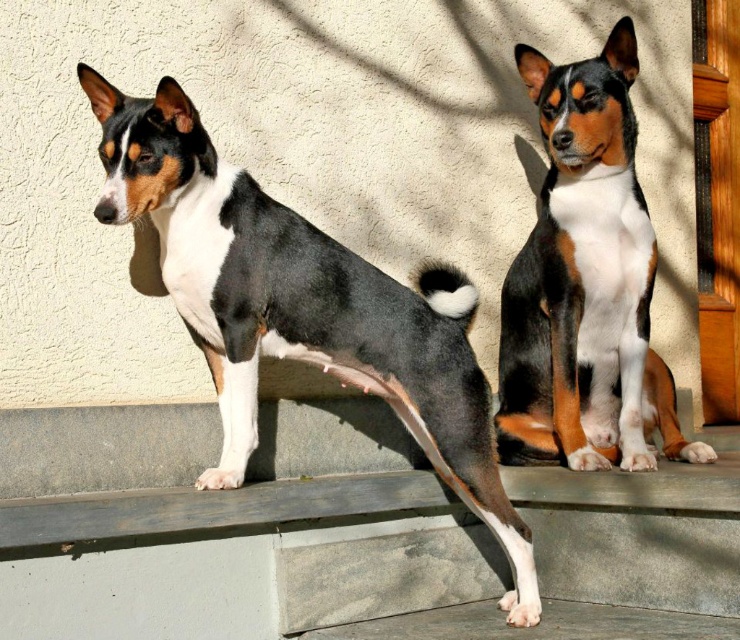
Who is higher up, black and white fur dog at center or tri-color fur dog at center?

Positioned higher is tri-color fur dog at center.

What do you see at coordinates (300, 307) in the screenshot? The height and width of the screenshot is (640, 740). I see `black and white fur dog at center` at bounding box center [300, 307].

Which is in front, point (185, 189) or point (593, 385)?

Point (185, 189)

Identify the location of black and white fur dog at center. (300, 307).